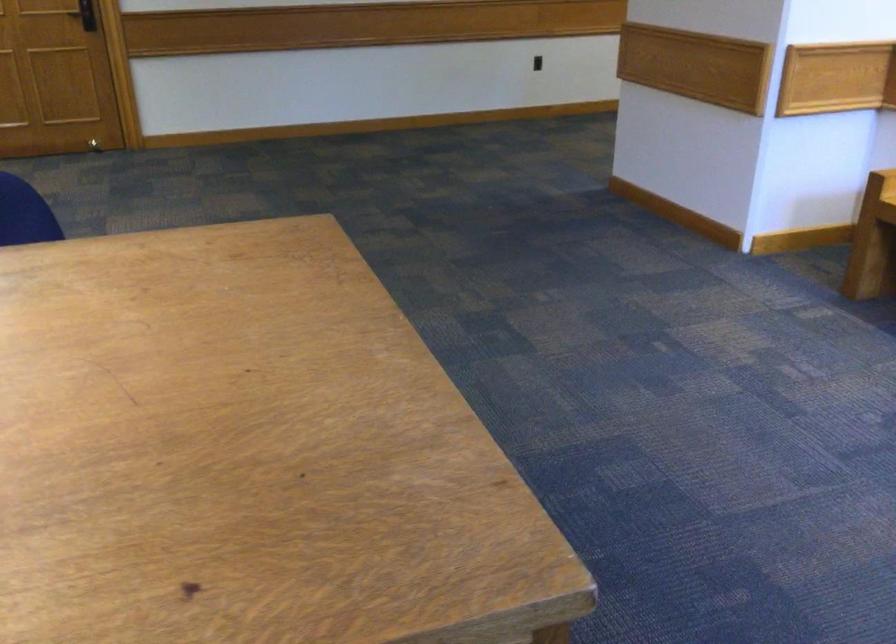
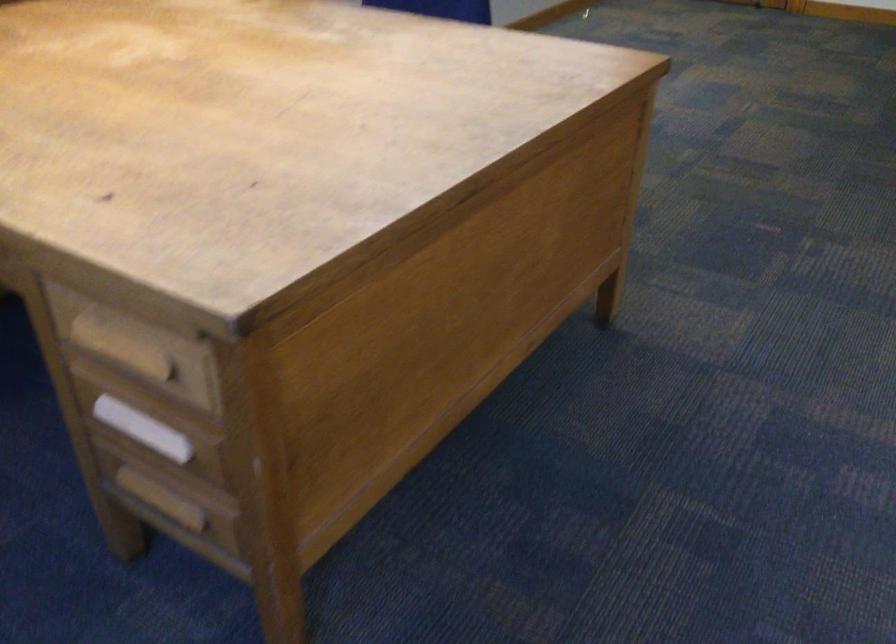
Question: The first image is from the beginning of the video and the second image is from the end. How did the camera likely rotate when shooting the video?

Choices:
 (A) Left
 (B) Right
 (C) Up
 (D) Down

Answer: (A)